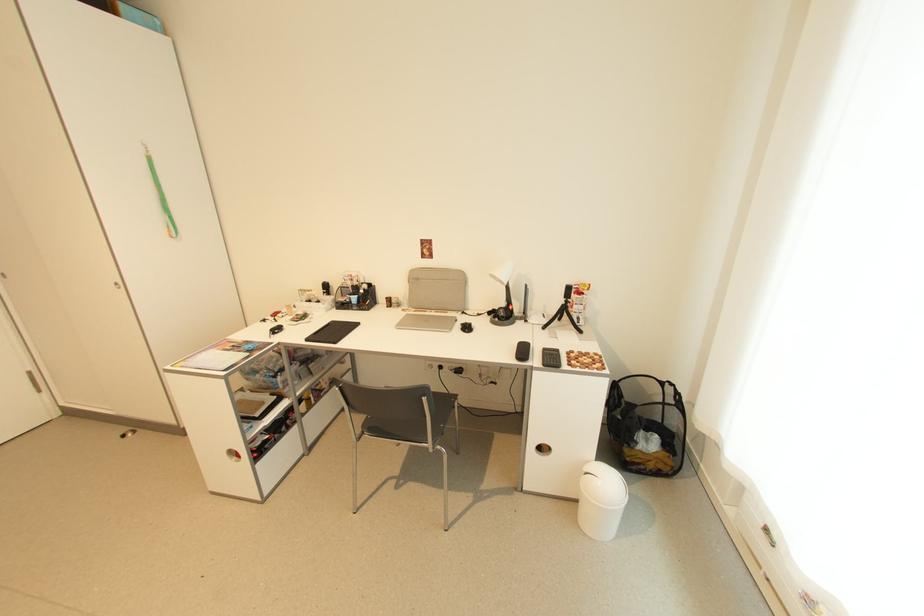
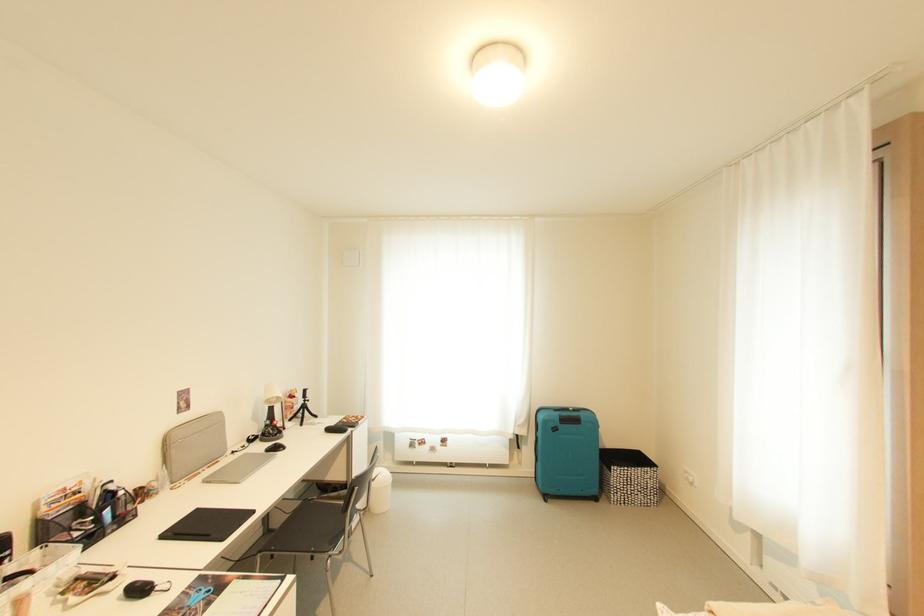
Locate, in the second image, the point that corresponds to (523,314) in the first image.

(262, 434)